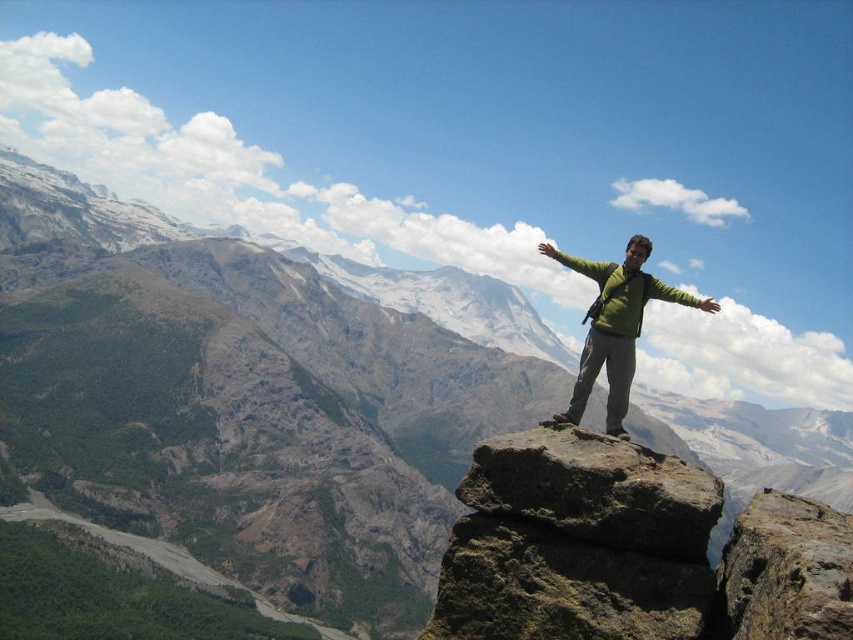
Can you confirm if brown rough rock at center is shorter than green matte hand at upper center?

No, brown rough rock at center is not shorter than green matte hand at upper center.

Is brown rough rock at center taller than green matte hand at upper center?

Yes, brown rough rock at center is taller than green matte hand at upper center.

Where is `brown rough rock at center`? This screenshot has height=640, width=853. brown rough rock at center is located at coordinates (596, 490).

What do you see at coordinates (785, 572) in the screenshot? This screenshot has height=640, width=853. I see `rusty rock at center` at bounding box center [785, 572].

Which is more to the left, rusty rock at center or green matte hand at upper center?

rusty rock at center is more to the left.

Which is behind, point (815, 611) or point (701, 307)?

The point (701, 307) is more distant.

Find the location of a particular element. rusty rock at center is located at coordinates [785, 572].

Who is positioned more to the right, green matte shirt at center or green matte hand at upper right?

green matte hand at upper right

Does green matte shirt at center have a lesser width compared to green matte hand at upper right?

Indeed, green matte shirt at center has a lesser width compared to green matte hand at upper right.

Between point (613, 342) and point (544, 248), which one is positioned in front?

Point (613, 342) is in front.

Locate an element on the screen. green matte shirt at center is located at coordinates (614, 328).